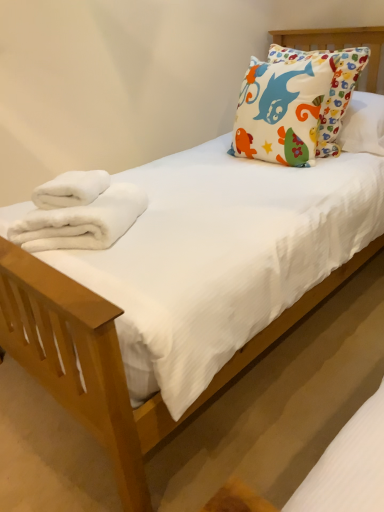
Question: From their relative heights in the image, would you say white fluffy towels at lower left, the first bath towel ordered from the bottom, is taller or shorter than white fluffy towel at left, which is the second bath towel in bottom-to-top order?

Choices:
 (A) short
 (B) tall

Answer: (B)

Question: Do you think white fluffy towels at lower left, the first bath towel ordered from the bottom, is within white fluffy towel at left, which is the second bath towel in bottom-to-top order, or outside of it?

Choices:
 (A) outside
 (B) inside

Answer: (A)

Question: Estimate the real-world distances between objects in this image. Which object is closer to the multicolored fabric pillow at upper right?

Choices:
 (A) white fluffy towel at left, which is the second bath towel in bottom-to-top order
 (B) white fluffy towels at lower left, which appears as the second bath towel when viewed from the top

Answer: (A)

Question: Which is nearer to the multicolored fabric pillow at upper right?

Choices:
 (A) white fluffy towels at lower left, which appears as the second bath towel when viewed from the top
 (B) white fluffy towel at left, which is the second bath towel in bottom-to-top order

Answer: (B)